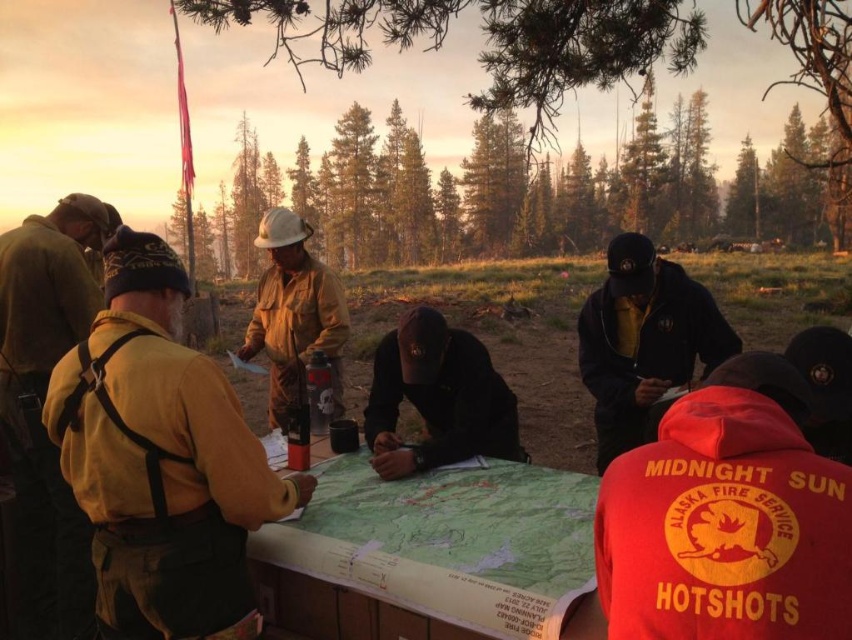
You are a firefighter planning to mark a critical location on the map. The map is placed on the table in the center of the image. Where should you place your mark to ensure it is at the point labeled as point [448,541]?

The point [448,541] is located on the green paper map at center, so you should place your mark there on the green paper map at center.

You are part of a search and rescue team trying to determine the best path through the forest. You notice two markers on the map corresponding to the yellow fabric vest at left and the matte brown uniform at center. Based on their positions, which marker is higher up on the map?

The yellow fabric vest at left is taller than matte brown uniform at center, so the marker for the yellow fabric vest at left is higher up on the map.

You are part of a fire safety team assessing the layout of the group around the map. Which object is positioned to the left of the other between the yellow fabric vest at left and the matte brown uniform at center?

The yellow fabric vest at left is to the left of the matte brown uniform at center, so the yellow fabric vest at left is positioned to the left of the matte brown uniform at center.